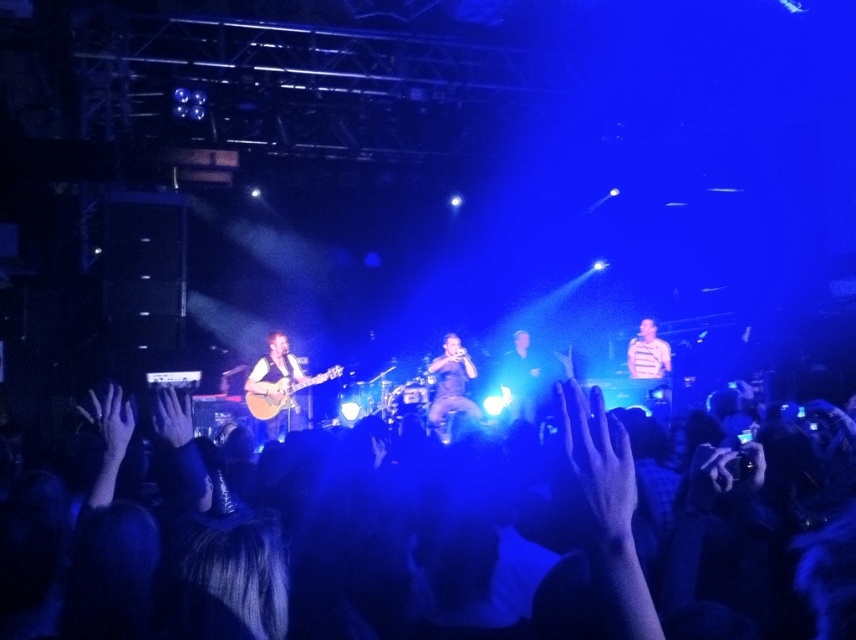
Question: Which of the following is the closest to the observer?

Choices:
 (A) (263, 417)
 (B) (646, 356)
 (C) (504, 376)
 (D) (135, 544)

Answer: (D)

Question: Can you confirm if shiny black guitar at center is smaller than striped shirt at right?

Choices:
 (A) yes
 (B) no

Answer: (B)

Question: Which point is farther to the camera?

Choices:
 (A) shiny black guitar at center
 (B) shiny black microphone at center
 (C) acoustic guitar at left
 (D) matte brown acoustic guitar at left

Answer: (A)

Question: Can you confirm if black fabric hands at lower center is thinner than shiny black guitar at center?

Choices:
 (A) yes
 (B) no

Answer: (B)

Question: Can you confirm if shiny black guitar at center is bigger than striped shirt at right?

Choices:
 (A) no
 (B) yes

Answer: (B)

Question: Which object appears closest to the camera in this image?

Choices:
 (A) shiny black guitar at center
 (B) striped shirt at right

Answer: (A)